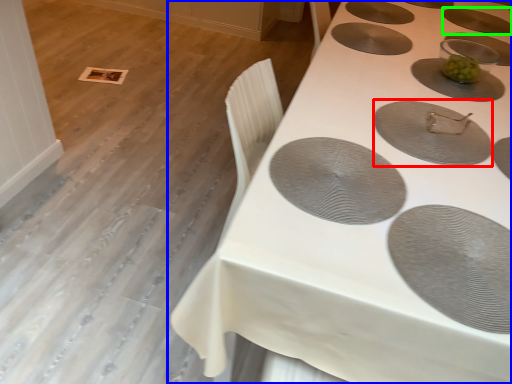
Question: Estimate the real-world distances between objects in this image. Which object is closer to oval (highlighted by a red box), table (highlighted by a blue box) or oval (highlighted by a green box)?

Choices:
 (A) table
 (B) oval

Answer: (A)